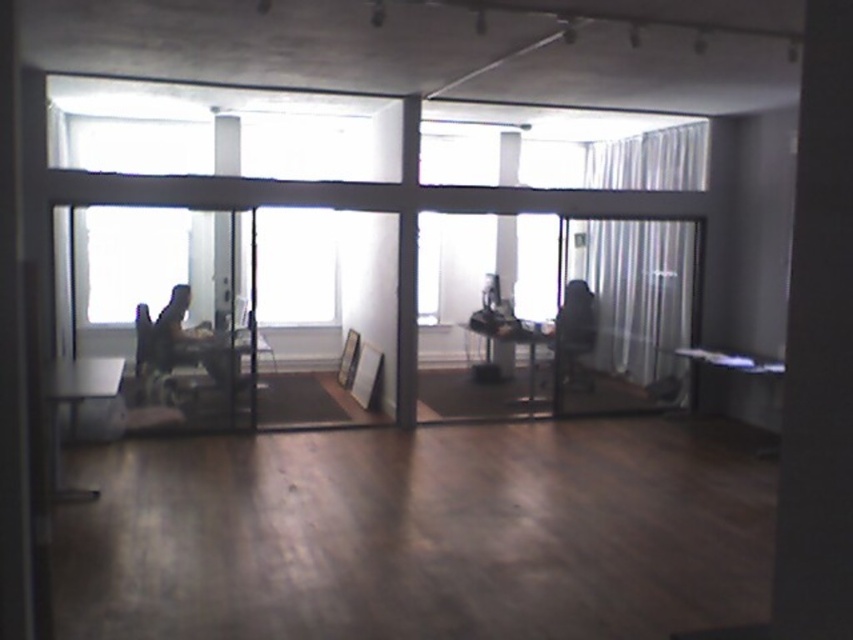
Between point (279, 262) and point (152, 326), which one is positioned behind?

The point (279, 262) is behind.

Can you confirm if transparent glass window at center is shorter than dark gray fabric chair at left?

No, transparent glass window at center is not shorter than dark gray fabric chair at left.

Describe the element at coordinates (294, 266) in the screenshot. I see `transparent glass window at center` at that location.

I want to click on transparent glass window at center, so click(x=294, y=266).

In the scene shown: Which of these two, dark gray fabric chair at left or black fabric chair at center, stands shorter?

With less height is dark gray fabric chair at left.

Is dark gray fabric chair at left bigger than black fabric chair at center?

Actually, dark gray fabric chair at left might be smaller than black fabric chair at center.

Is point (173, 346) farther from viewer compared to point (570, 353)?

No, it is not.

Locate an element on the screen. This screenshot has height=640, width=853. dark gray fabric chair at left is located at coordinates (189, 342).

Who is more distant from viewer, [265,234] or [589,349]?

The point [265,234] is more distant.

The image size is (853, 640). What do you see at coordinates (294, 266) in the screenshot?
I see `transparent glass window at center` at bounding box center [294, 266].

Who is more forward, (294, 288) or (569, 320)?

Point (569, 320)

Find the location of a particular element. The image size is (853, 640). transparent glass window at center is located at coordinates (294, 266).